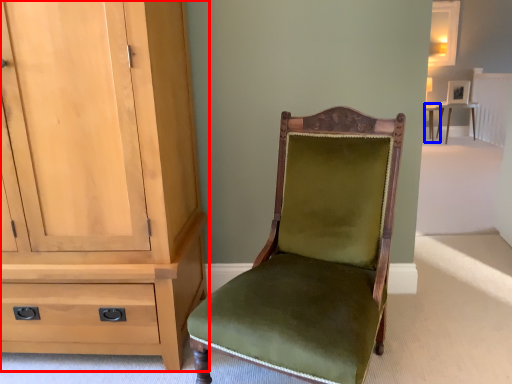
Question: Which object appears farthest to the camera in this image, cabinetry (highlighted by a red box) or table (highlighted by a blue box)?

Choices:
 (A) cabinetry
 (B) table

Answer: (B)